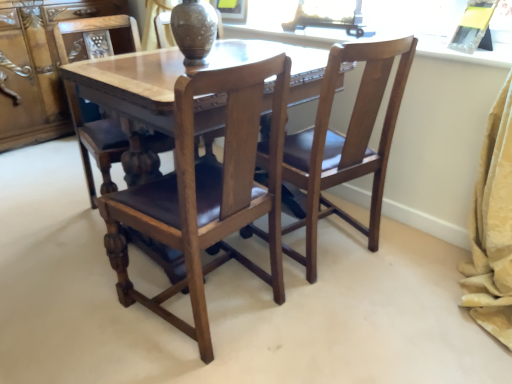
Question: From the image's perspective, is brown matte vase at center beneath wooden cabinet at left?

Choices:
 (A) yes
 (B) no

Answer: (A)

Question: Can you confirm if brown matte vase at center is wider than wooden cabinet at left?

Choices:
 (A) no
 (B) yes

Answer: (A)

Question: From a real-world perspective, is brown matte vase at center beneath wooden cabinet at left?

Choices:
 (A) no
 (B) yes

Answer: (A)

Question: Is brown matte vase at center not close to wooden cabinet at left?

Choices:
 (A) yes
 (B) no

Answer: (A)

Question: Is brown matte vase at center not within wooden cabinet at left?

Choices:
 (A) no
 (B) yes

Answer: (B)

Question: Considering the positions of brown matte vase at center and wooden cabinet at left in the image, is brown matte vase at center bigger or smaller than wooden cabinet at left?

Choices:
 (A) small
 (B) big

Answer: (A)

Question: Is brown matte vase at center inside the boundaries of wooden cabinet at left, or outside?

Choices:
 (A) inside
 (B) outside

Answer: (B)

Question: From their relative heights in the image, would you say brown matte vase at center is taller or shorter than wooden cabinet at left?

Choices:
 (A) short
 (B) tall

Answer: (A)

Question: Would you say brown matte vase at center is to the left or to the right of wooden cabinet at left in the picture?

Choices:
 (A) left
 (B) right

Answer: (B)

Question: From the image's perspective, is polished wood chair at center, the 2th chair when ordered from right to left, positioned above or below wooden polished table at center?

Choices:
 (A) below
 (B) above

Answer: (A)

Question: Looking at their shapes, would you say polished wood chair at center, the 2th chair when ordered from right to left, is wider or thinner than wooden polished table at center?

Choices:
 (A) wide
 (B) thin

Answer: (B)

Question: Choose the correct answer: Is polished wood chair at center, the 2th chair positioned from the left, inside wooden polished table at center or outside it?

Choices:
 (A) inside
 (B) outside

Answer: (A)

Question: Is point (166, 292) closer or farther from the camera than point (268, 82)?

Choices:
 (A) closer
 (B) farther

Answer: (B)

Question: From the image's perspective, relative to wooden polished table at center, is wooden cabinet at left above or below?

Choices:
 (A) above
 (B) below

Answer: (A)

Question: Considering the positions of wooden cabinet at left and wooden polished table at center in the image, is wooden cabinet at left taller or shorter than wooden polished table at center?

Choices:
 (A) tall
 (B) short

Answer: (A)